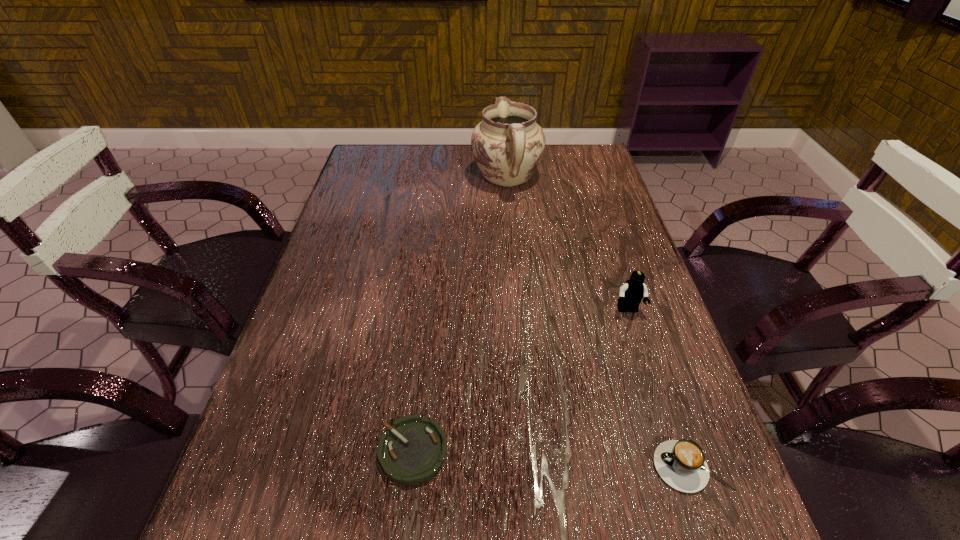
The width and height of the screenshot is (960, 540). Identify the location of free spot between the leftmost object and the third tallest object. (552, 459).

Where is `vacant space in between the cappuccino and the farthest object`? The image size is (960, 540). vacant space in between the cappuccino and the farthest object is located at coordinates (598, 322).

Image resolution: width=960 pixels, height=540 pixels. Identify the location of vacant area that lies between the third tallest object and the second farthest object. (660, 389).

Locate an element on the screen. This screenshot has height=540, width=960. blank region between the Lego and the farthest object is located at coordinates point(567,244).

At what (x,y) coordinates should I click in order to perform the action: click on free space between the second shortest object and the shortest object. Please return your answer as a coordinate pair (x, y). Looking at the image, I should click on (552, 459).

Locate an element on the screen. Image resolution: width=960 pixels, height=540 pixels. free space that is in between the third shortest object and the ashtray is located at coordinates (520, 381).

You are a GUI agent. You are given a task and a screenshot of the screen. Output one action in this format:
    pyautogui.click(x=<x>, y=<y>)
    Task: Click on the vacant area between the second tallest object and the cappuccino
    The height and width of the screenshot is (540, 960).
    Given the screenshot: What is the action you would take?
    pyautogui.click(x=660, y=389)

The width and height of the screenshot is (960, 540). I want to click on vacant area that lies between the second tallest object and the third tallest object, so click(660, 389).

Find the location of `vacant space in between the farthest object and the ashtray`. vacant space in between the farthest object and the ashtray is located at coordinates (460, 314).

Locate an element on the screen. This screenshot has width=960, height=540. object that ranks as the second closest to the cappuccino is located at coordinates (413, 449).